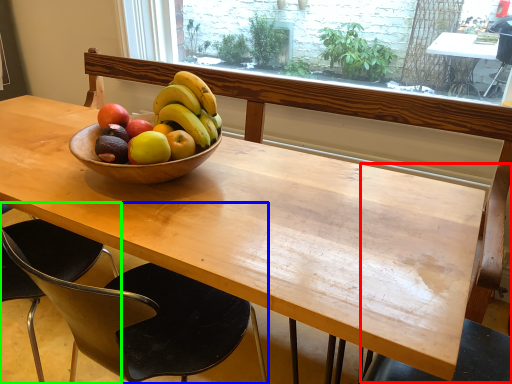
Question: Considering the real-world distances, which object is closest to chair (highlighted by a red box)? chair (highlighted by a blue box) or chair (highlighted by a green box).

Choices:
 (A) chair
 (B) chair

Answer: (A)